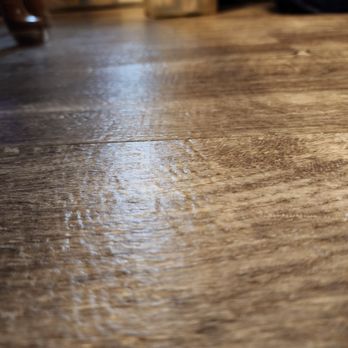
Where is `foot of furniture`? The height and width of the screenshot is (348, 348). foot of furniture is located at coordinates (27, 34).